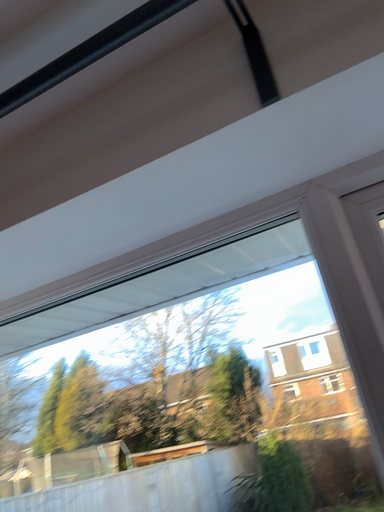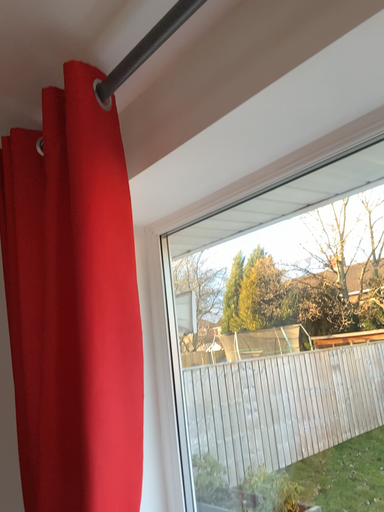
Question: How did the camera likely rotate when shooting the video?

Choices:
 (A) rotated left
 (B) rotated right

Answer: (A)